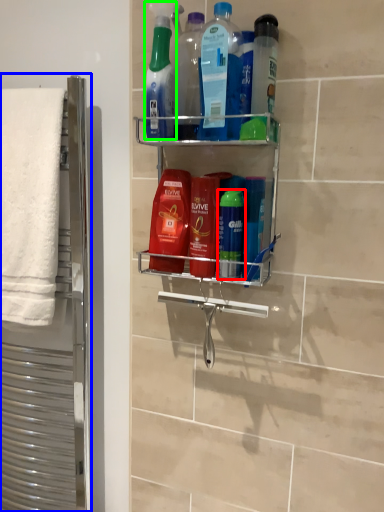
Question: Which is nearer to the mouthwash (highlighted by a red box)? screen door (highlighted by a blue box) or cleaning product (highlighted by a green box).

Choices:
 (A) screen door
 (B) cleaning product

Answer: (B)